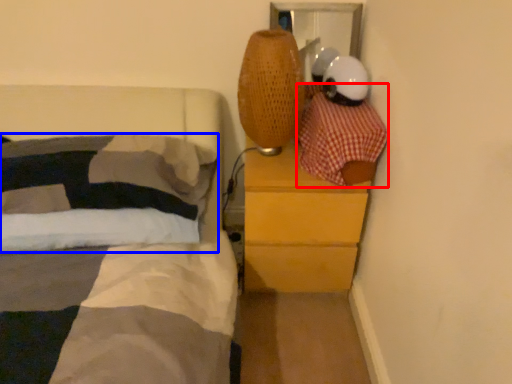
Question: Among these objects, which one is farthest to the camera, blanket (highlighted by a red box) or pillow (highlighted by a blue box)?

Choices:
 (A) blanket
 (B) pillow

Answer: (B)